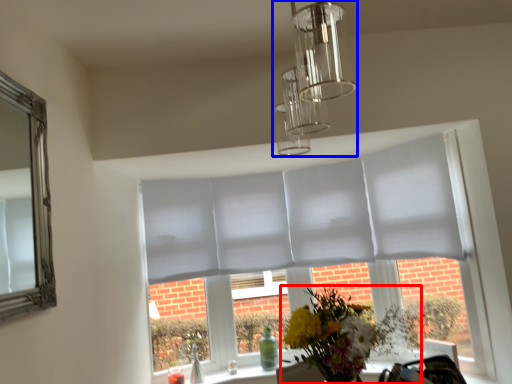
Question: Which of the following is the closest to the observer, flower (highlighted by a red box) or light fixture (highlighted by a blue box)?

Choices:
 (A) flower
 (B) light fixture

Answer: (B)